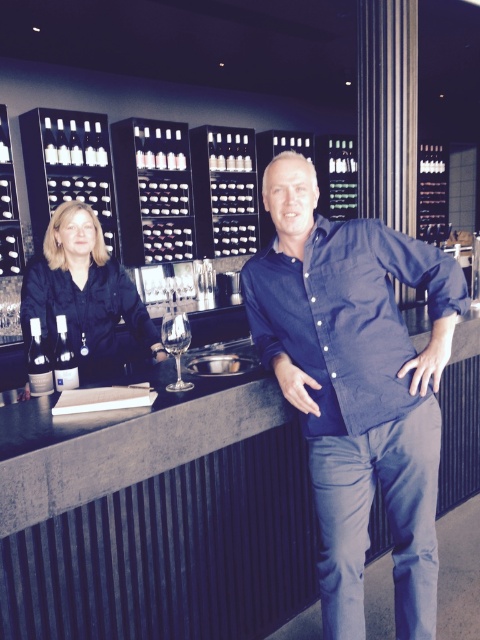
Question: Considering the real-world distances, which object is closest to the matte black shirt at left?

Choices:
 (A) dark blue denim shirt at center
 (B) clear glass wine glass at center

Answer: (B)

Question: Which point is farther from the camera taking this photo?

Choices:
 (A) (165, 328)
 (B) (348, 470)

Answer: (A)

Question: Is matte black shirt at left positioned before clear glass wine glass at center?

Choices:
 (A) yes
 (B) no

Answer: (B)

Question: Which object is closer to the camera taking this photo?

Choices:
 (A) matte black shirt at left
 (B) dark blue denim shirt at center

Answer: (B)

Question: Is dark blue denim shirt at center positioned before matte black shirt at left?

Choices:
 (A) no
 (B) yes

Answer: (B)

Question: Where is matte black shirt at left located in relation to clear glass wine glass at center in the image?

Choices:
 (A) below
 (B) above

Answer: (B)